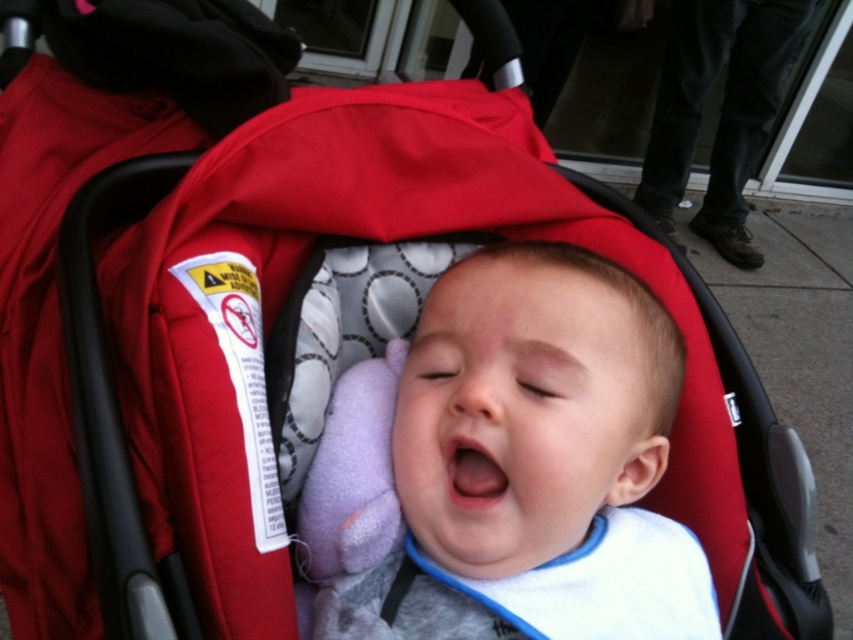
How far apart are smooth cotton baby at center and black leather pants at upper right?

The distance of smooth cotton baby at center from black leather pants at upper right is 2.29 meters.

Does point (659, 541) come behind point (730, 54)?

No, (659, 541) is in front of (730, 54).

Who is more forward, (422, 332) or (775, 44)?

Point (422, 332) is more forward.

Identify the location of smooth cotton baby at center. (509, 465).